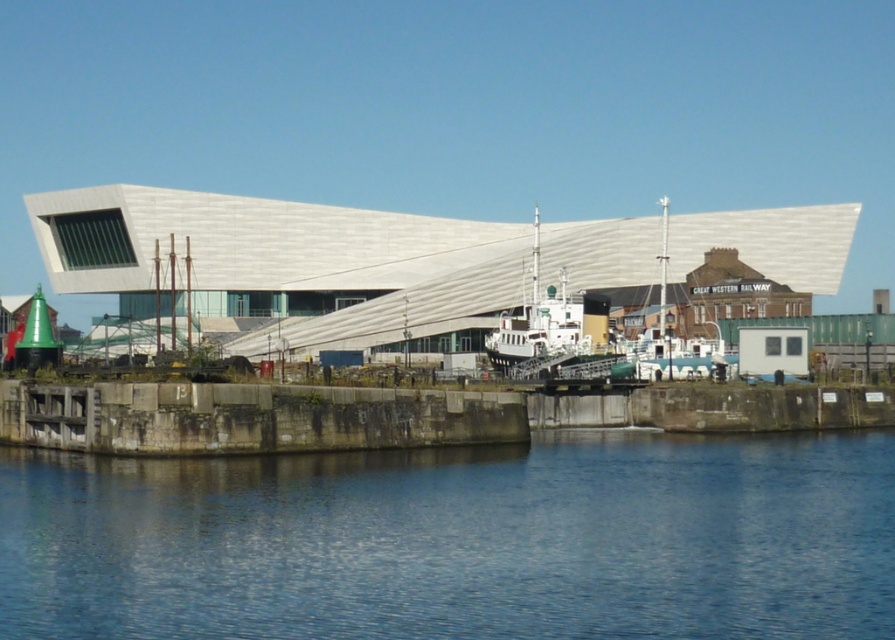
Question: Can you confirm if white matte boat at center is positioned to the right of white wooden boat at center?

Choices:
 (A) yes
 (B) no

Answer: (B)

Question: Among these points, which one is nearest to the camera?

Choices:
 (A) (655, 380)
 (B) (744, 548)

Answer: (B)

Question: Does blue smooth water at lower center appear under white wooden boat at center?

Choices:
 (A) yes
 (B) no

Answer: (A)

Question: Can you confirm if blue smooth water at lower center is positioned below white wooden boat at center?

Choices:
 (A) no
 (B) yes

Answer: (B)

Question: Which of the following is the closest to the observer?

Choices:
 (A) (527, 330)
 (B) (646, 339)

Answer: (B)

Question: Which of the following is the closest to the observer?

Choices:
 (A) (49, 544)
 (B) (510, 328)
 (C) (659, 298)

Answer: (A)